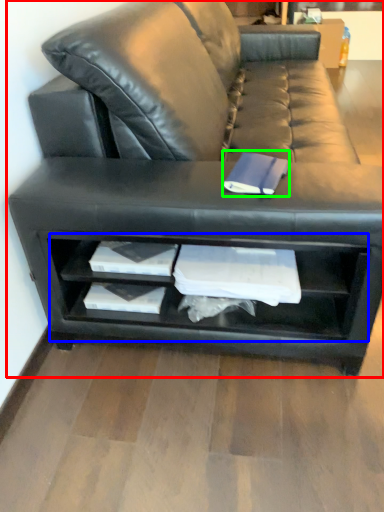
Question: Based on their relative distances, which object is farther from studio couch (highlighted by a red box)? Choose from shelf (highlighted by a blue box) and paperback book (highlighted by a green box).

Choices:
 (A) shelf
 (B) paperback book

Answer: (B)